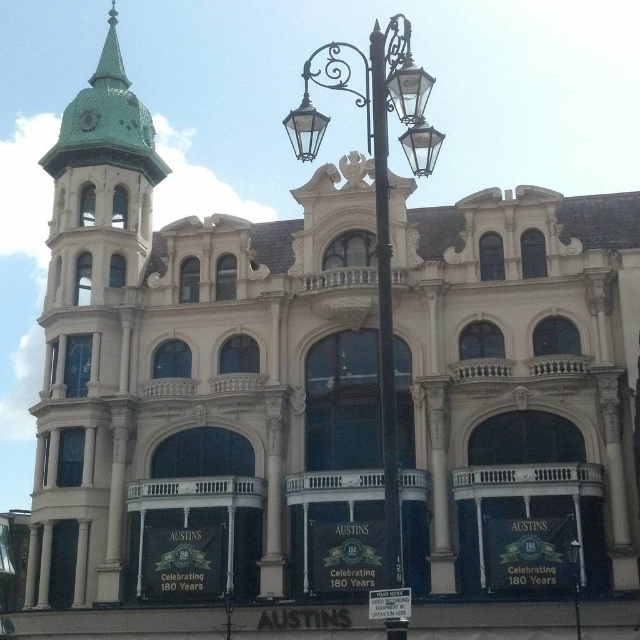
Which is in front, point (369, 104) or point (93, 81)?

Point (369, 104) is in front.

Is polished metal streetlamp at center wider than green glazed tile spire at upper left?

Incorrect, polished metal streetlamp at center's width does not surpass green glazed tile spire at upper left's.

Locate an element on the screen. polished metal streetlamp at center is located at coordinates (385, 269).

Can you confirm if polished brass street light at center is thinner than polished metal streetlamp at center?

No.

Measure the distance between point (426, 148) and camera.

A distance of 128.78 feet exists between point (426, 148) and camera.

Describe the element at coordinates (378, 196) in the screenshot. I see `polished brass street light at center` at that location.

The image size is (640, 640). Find the location of `polished brass street light at center`. polished brass street light at center is located at coordinates (378, 196).

Is green painted metal bell tower at left thinner than polished metal streetlamp at center?

In fact, green painted metal bell tower at left might be wider than polished metal streetlamp at center.

Does green painted metal bell tower at left appear on the right side of polished metal streetlamp at center?

In fact, green painted metal bell tower at left is to the left of polished metal streetlamp at center.

Does point (141, 196) come closer to viewer compared to point (388, 38)?

No, (141, 196) is further to viewer.

Locate an element on the screen. The height and width of the screenshot is (640, 640). green painted metal bell tower at left is located at coordinates (90, 333).